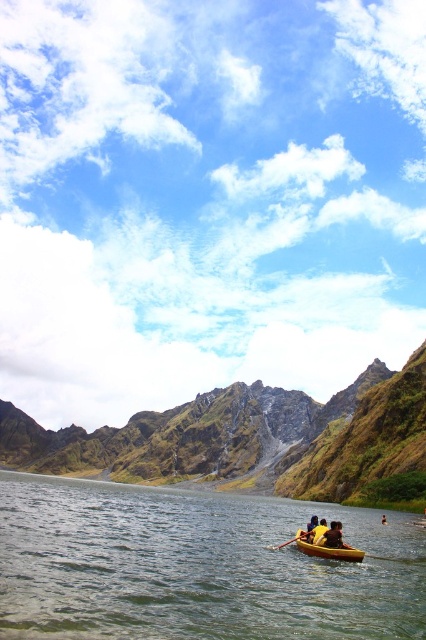
You are a photographer planning to take a photo of the yellow matte boat at lower center and the yellow fabric person at center. Based on their heights, which object should be placed closer to the camera to ensure both are fully visible in the frame?

The yellow matte boat at lower center is shorter than the yellow fabric person at center. To ensure both are fully visible, place the boat closer to the camera so its smaller size compensates for its shorter height, while the taller person can be positioned slightly farther back.

You are a photographer planning to capture the reflection of the yellow wood paddle at center and the yellow fabric person at center in the calm water. Which object will have its reflection closer to the photographer?

The yellow wood paddle at center is positioned over yellow fabric person at center, so its reflection will be closer to the photographer.

You are a tourist on a boat and want to take a photo of the yellow wood paddle at center and the yellow fabric person at center. Which object should you focus on first if you want to capture both in the frame without moving the camera?

The yellow wood paddle at center is positioned on the left side of yellow fabric person at center, so you should focus on the yellow wood paddle at center first to ensure both are in the frame without moving the camera.